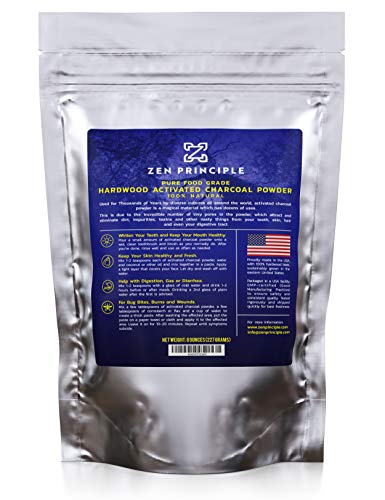
Where is `plastic container`? plastic container is located at coordinates (194, 410), (74, 69), (299, 63).